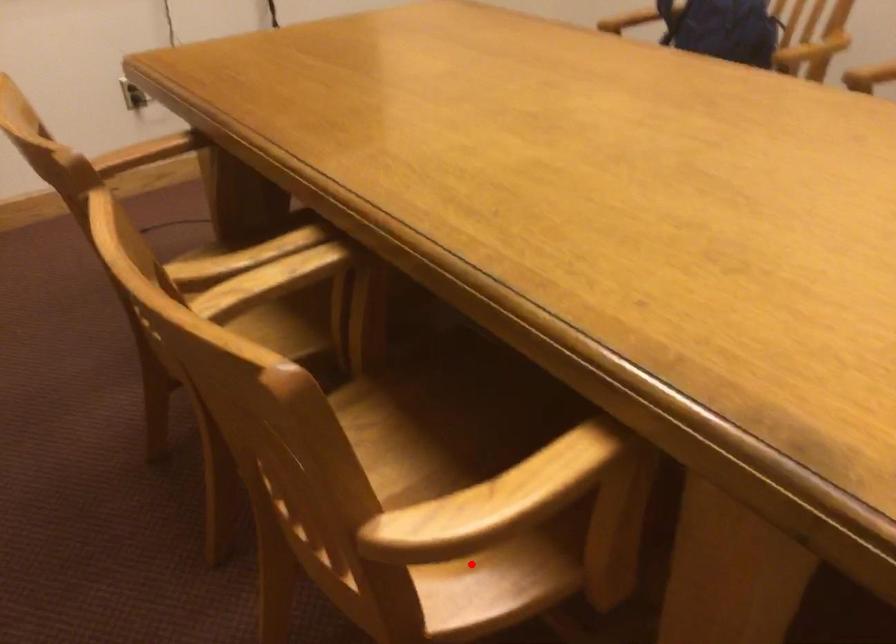
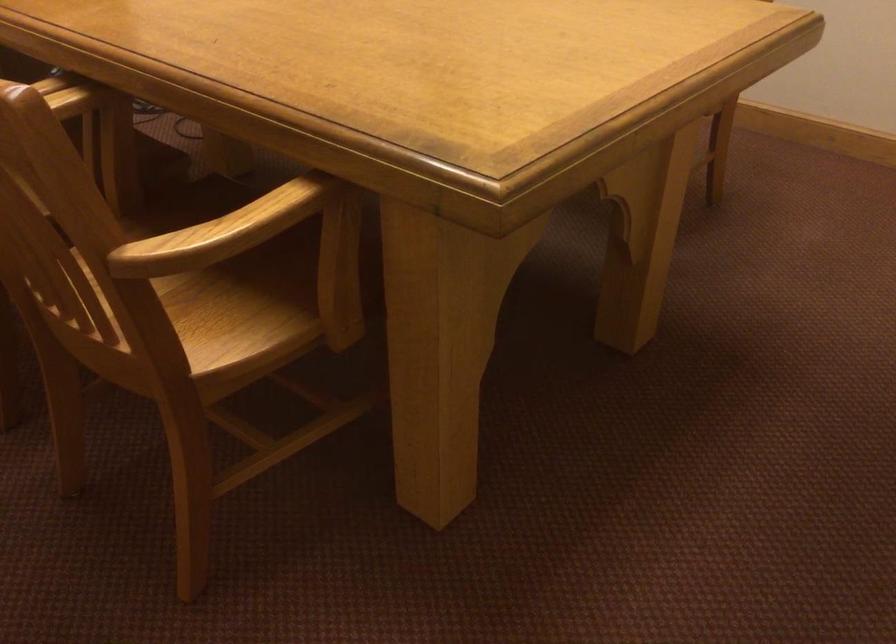
Question: I am providing you with two images of the same scene from different viewpoints. Image1 has a red point marked. In image2, the corresponding 3D location appears at what relative position? Reply with the corresponding letter.

Choices:
 (A) Closer
 (B) Farther

Answer: (B)